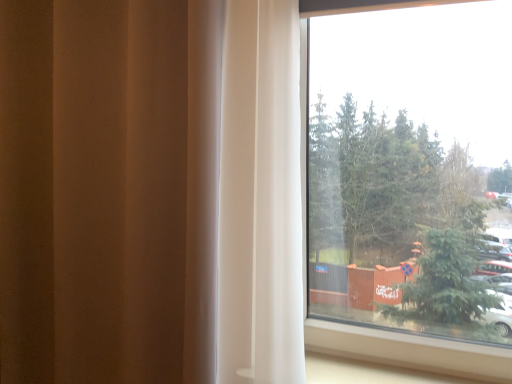
Question: Is the position of transparent glass window at upper right more distant than that of white sheer curtain at right?

Choices:
 (A) yes
 (B) no

Answer: (A)

Question: From a real-world perspective, is transparent glass window at upper right located beneath white sheer curtain at right?

Choices:
 (A) yes
 (B) no

Answer: (B)

Question: Does transparent glass window at upper right have a smaller size compared to white sheer curtain at right?

Choices:
 (A) yes
 (B) no

Answer: (A)

Question: Is transparent glass window at upper right turned away from white sheer curtain at right?

Choices:
 (A) yes
 (B) no

Answer: (B)

Question: Are transparent glass window at upper right and white sheer curtain at right making contact?

Choices:
 (A) yes
 (B) no

Answer: (B)

Question: Considering the relative positions of transparent glass window at upper right and white sheer curtain at right in the image provided, is transparent glass window at upper right to the right of white sheer curtain at right from the viewer's perspective?

Choices:
 (A) yes
 (B) no

Answer: (A)

Question: From the image's perspective, does white sheer curtain at right appear higher than transparent glass window at upper right?

Choices:
 (A) no
 (B) yes

Answer: (A)

Question: Is white sheer curtain at right at the right side of transparent glass window at upper right?

Choices:
 (A) no
 (B) yes

Answer: (A)

Question: Is white sheer curtain at right completely or partially outside of transparent glass window at upper right?

Choices:
 (A) no
 (B) yes

Answer: (B)

Question: From the image's perspective, is white sheer curtain at right located beneath transparent glass window at upper right?

Choices:
 (A) no
 (B) yes

Answer: (B)

Question: Is white sheer curtain at right shorter than transparent glass window at upper right?

Choices:
 (A) no
 (B) yes

Answer: (A)

Question: Is white sheer curtain at right thinner than transparent glass window at upper right?

Choices:
 (A) no
 (B) yes

Answer: (A)

Question: In terms of width, does transparent glass window at upper right look wider or thinner when compared to white sheer curtain at right?

Choices:
 (A) thin
 (B) wide

Answer: (A)